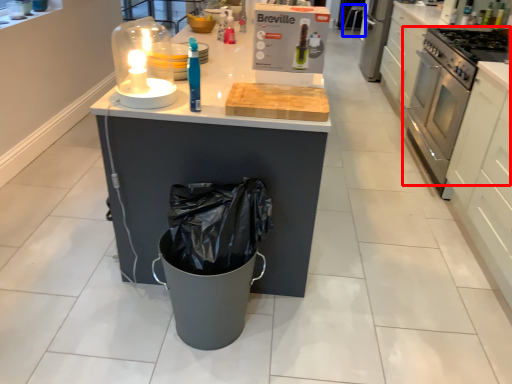
Question: Which point is further to the camera, home appliance (highlighted by a red box) or bar stool (highlighted by a blue box)?

Choices:
 (A) home appliance
 (B) bar stool

Answer: (B)